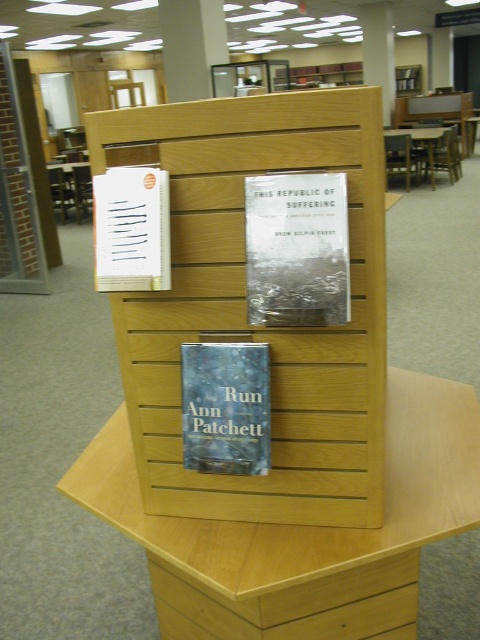
Does wooden at center come behind white paper at upper left?

Yes, it is behind white paper at upper left.

The image size is (480, 640). What do you see at coordinates (302, 531) in the screenshot?
I see `wooden at center` at bounding box center [302, 531].

Where is `wooden at center`? Image resolution: width=480 pixels, height=640 pixels. wooden at center is located at coordinates (302, 531).

Looking at this image, is wooden table at center to the right of brown wooden table at center from the viewer's perspective?

In fact, wooden table at center is to the left of brown wooden table at center.

Is wooden table at center thinner than brown wooden table at center?

Indeed, wooden table at center has a lesser width compared to brown wooden table at center.

Where is `wooden table at center`? wooden table at center is located at coordinates (70, 188).

Can you confirm if wooden at center is thinner than blue paper at center?

No.

Between point (129, 484) and point (250, 429), which one is positioned in front?

Positioned in front is point (250, 429).

Which is behind, point (372, 540) or point (235, 422)?

Point (372, 540)

You are a GUI agent. You are given a task and a screenshot of the screen. Output one action in this format:
    pyautogui.click(x=<x>, y=<y>)
    Task: Click on the wooden at center
    
    Given the screenshot: What is the action you would take?
    pyautogui.click(x=302, y=531)